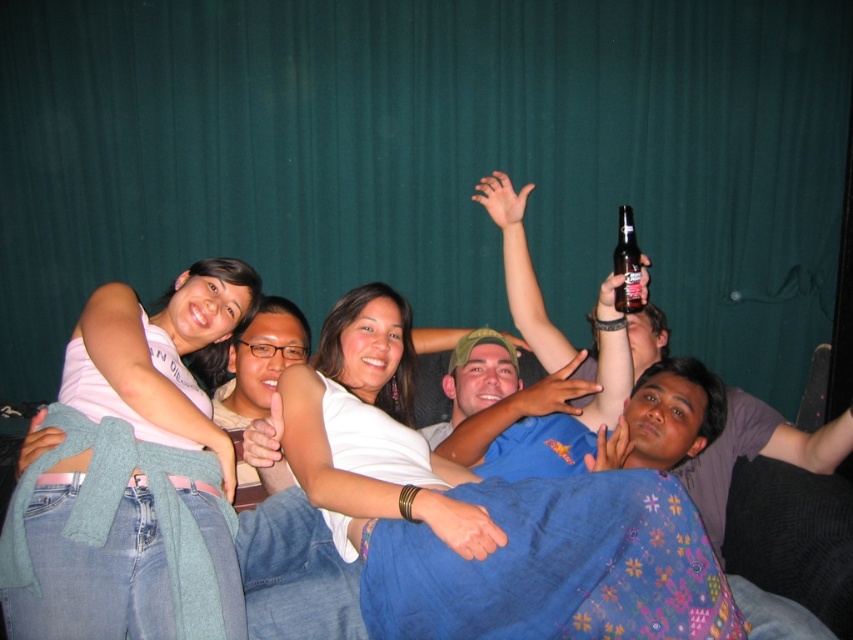
Question: Which point is farther to the camera?

Choices:
 (A) (637, 291)
 (B) (160, 362)

Answer: (A)

Question: Does white matte tank top at center come in front of clear glass bottle at upper right?

Choices:
 (A) no
 (B) yes

Answer: (B)

Question: Which of the following is the closest to the observer?

Choices:
 (A) (90, 358)
 (B) (635, 262)

Answer: (A)

Question: Does white matte tank top at center appear under clear glass bottle at upper right?

Choices:
 (A) no
 (B) yes

Answer: (B)

Question: In this image, where is white matte tank top at center located relative to clear glass bottle at upper right?

Choices:
 (A) right
 (B) left

Answer: (B)